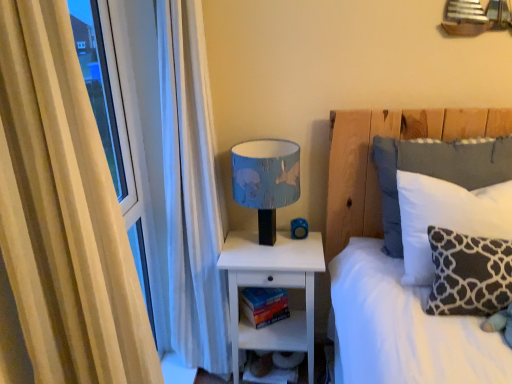
Find the location of a particular element. The width and height of the screenshot is (512, 384). free point above hardcover book at lower center (from a real-world perspective) is located at coordinates (260, 292).